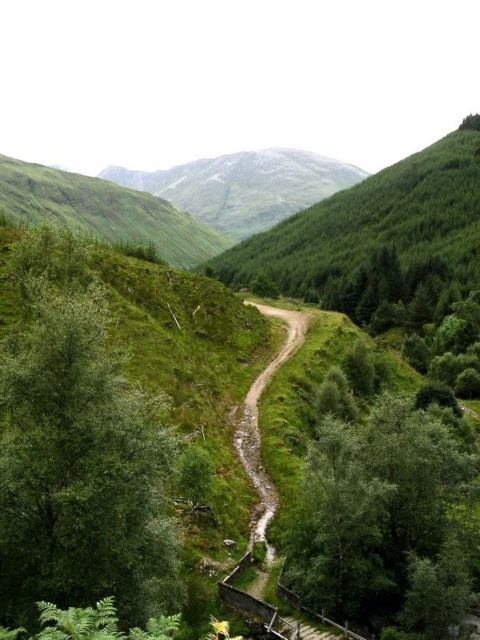
Can you confirm if green leafy tree at left is taller than green grassy mountain at upper center?

No, green leafy tree at left is not taller than green grassy mountain at upper center.

You are a GUI agent. You are given a task and a screenshot of the screen. Output one action in this format:
    pyautogui.click(x=<x>, y=<y>)
    Task: Click on the green leafy tree at left
    
    Given the screenshot: What is the action you would take?
    pyautogui.click(x=82, y=470)

The image size is (480, 640). I want to click on green leafy tree at left, so click(x=82, y=470).